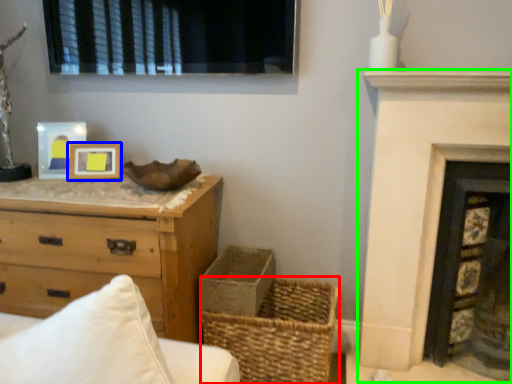
Question: Considering the real-world distances, which object is farthest from basket (highlighted by a red box)? picture frame (highlighted by a blue box) or fireplace (highlighted by a green box)?

Choices:
 (A) picture frame
 (B) fireplace

Answer: (A)